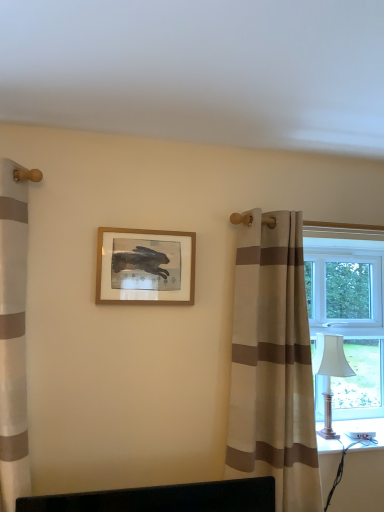
Question: Considering the positions of silver metallic table lamp at right and white plastic window at right in the image, is silver metallic table lamp at right wider or thinner than white plastic window at right?

Choices:
 (A) thin
 (B) wide

Answer: (B)

Question: In the image, is silver metallic table lamp at right positioned in front of or behind white plastic window at right?

Choices:
 (A) behind
 (B) front

Answer: (B)

Question: Which is farther from the wooden picture frame at center?

Choices:
 (A) beige striped curtain at right
 (B) white plastic window at right
 (C) silver metallic table lamp at right

Answer: (C)

Question: Estimate the real-world distances between objects in this image. Which object is farther from the wooden picture frame at center?

Choices:
 (A) white plastic window at right
 (B) beige striped curtain at right
 (C) silver metallic table lamp at right

Answer: (C)